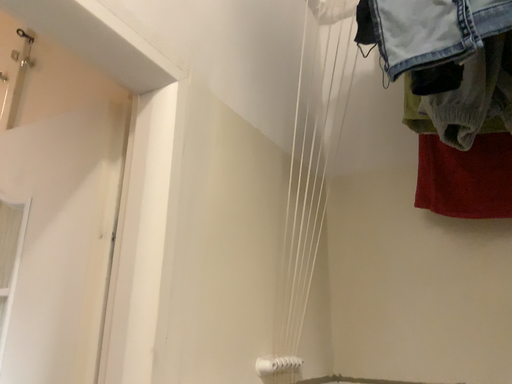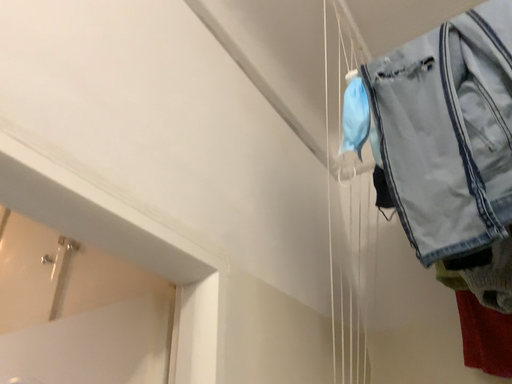
Question: How did the camera likely rotate when shooting the video?

Choices:
 (A) rotated downward
 (B) rotated upward

Answer: (B)